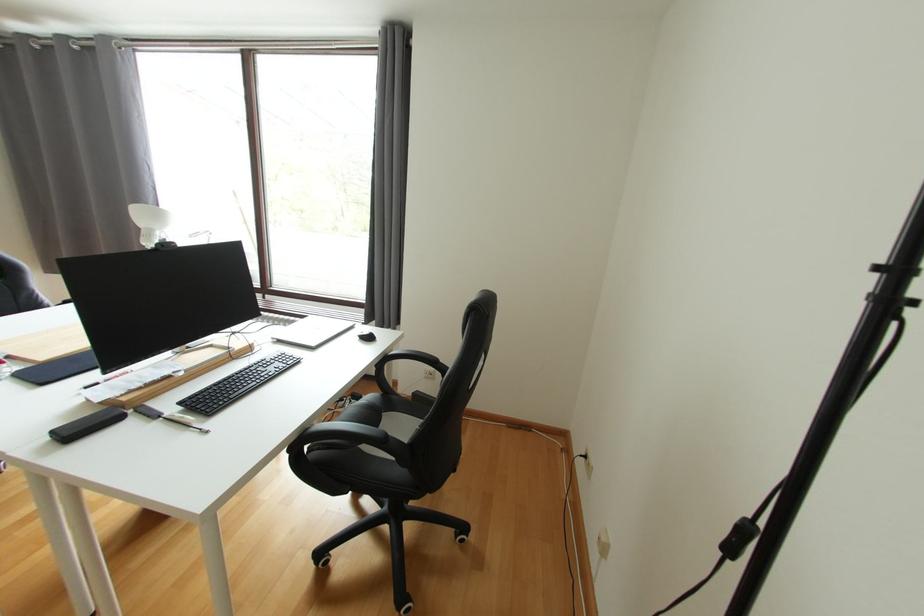
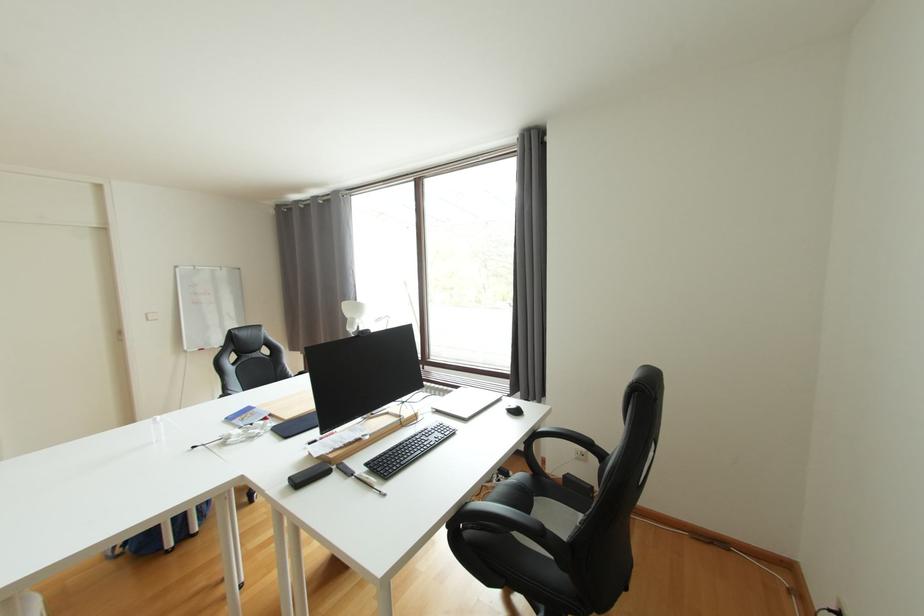
Question: The camera is either moving clockwise (left) or counter-clockwise (right) around the object. The first image is from the beginning of the video and the second image is from the end. Is the camera moving left or right when shooting the video?

Choices:
 (A) Left
 (B) Right

Answer: (B)